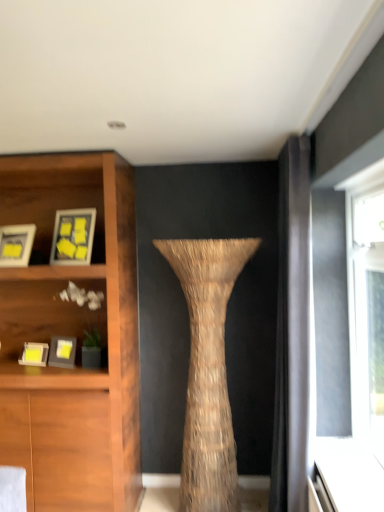
I want to click on matte gray picture frame at left, acting as the fourth picture frame starting from the top, so click(34, 354).

Where is `matte wooden picture frame at upper left, which is counted as the 1th picture frame, starting from the top`? matte wooden picture frame at upper left, which is counted as the 1th picture frame, starting from the top is located at coordinates (73, 236).

This screenshot has height=512, width=384. Describe the element at coordinates (73, 236) in the screenshot. I see `matte wooden picture frame at upper left, the fourth picture frame from the bottom` at that location.

Measure the distance between matte black picture frame at upper left, which is the 3th picture frame from bottom to top, and camera.

matte black picture frame at upper left, which is the 3th picture frame from bottom to top, and camera are 2.80 meters apart.

Identify the location of matte black picture frame at left, the 3th picture frame viewed from the top. The height and width of the screenshot is (512, 384). (62, 352).

Choose the correct answer: Is braided straw vase at center inside matte black picture frame at left, the 2th picture frame from the bottom, or outside it?

braided straw vase at center cannot be found inside matte black picture frame at left, the 2th picture frame from the bottom.

Locate an element on the screen. This screenshot has width=384, height=512. picture frame that is the 2nd one when counting upward from the braided straw vase at center (from the image's perspective) is located at coordinates (62, 352).

Can you confirm if braided straw vase at center is wider than matte black picture frame at left, the 2th picture frame from the bottom?

Correct, the width of braided straw vase at center exceeds that of matte black picture frame at left, the 2th picture frame from the bottom.

Between braided straw vase at center and matte black picture frame at left, the 2th picture frame from the bottom, which one appears on the right side from the viewer's perspective?

braided straw vase at center.

Is matte black picture frame at upper left, which is the 3th picture frame from bottom to top, further to camera compared to matte gray picture frame at left, acting as the fourth picture frame starting from the top?

No, matte black picture frame at upper left, which is the 3th picture frame from bottom to top, is in front of matte gray picture frame at left, acting as the fourth picture frame starting from the top.

Considering the relative sizes of matte black picture frame at upper left, which ranks as the 2th picture frame in top-to-bottom order, and matte gray picture frame at left, which is the first picture frame from bottom to top, in the image provided, is matte black picture frame at upper left, which ranks as the 2th picture frame in top-to-bottom order, shorter than matte gray picture frame at left, which is the first picture frame from bottom to top,?

No.

Does matte black picture frame at upper left, which is the 3th picture frame from bottom to top, have a greater width compared to matte gray picture frame at left, which is the first picture frame from bottom to top?

Yes.

Could you tell me if matte black picture frame at upper left, which ranks as the 2th picture frame in top-to-bottom order, is turned towards matte gray picture frame at left, acting as the fourth picture frame starting from the top?

No, matte black picture frame at upper left, which ranks as the 2th picture frame in top-to-bottom order, is not turned towards matte gray picture frame at left, acting as the fourth picture frame starting from the top.

Is matte gray picture frame at left, acting as the fourth picture frame starting from the top, further to camera compared to matte black picture frame at left, the 3th picture frame viewed from the top?

Yes, the depth of matte gray picture frame at left, acting as the fourth picture frame starting from the top, is greater than that of matte black picture frame at left, the 3th picture frame viewed from the top.

Is matte gray picture frame at left, acting as the fourth picture frame starting from the top, shorter than matte black picture frame at left, the 3th picture frame viewed from the top?

Indeed, matte gray picture frame at left, acting as the fourth picture frame starting from the top, has a lesser height compared to matte black picture frame at left, the 3th picture frame viewed from the top.

Does point (28, 358) come behind point (59, 344)?

No, (28, 358) is in front of (59, 344).

Considering the relative sizes of matte black picture frame at upper left, which is the 3th picture frame from bottom to top, and matte black picture frame at left, the 2th picture frame from the bottom, in the image provided, is matte black picture frame at upper left, which is the 3th picture frame from bottom to top, taller than matte black picture frame at left, the 2th picture frame from the bottom,?

Yes, matte black picture frame at upper left, which is the 3th picture frame from bottom to top, is taller than matte black picture frame at left, the 2th picture frame from the bottom.

Is matte black picture frame at left, the 3th picture frame viewed from the top, inside matte black picture frame at upper left, which is the 3th picture frame from bottom to top?

No, matte black picture frame at upper left, which is the 3th picture frame from bottom to top, does not contain matte black picture frame at left, the 3th picture frame viewed from the top.

Considering the points (19, 239) and (74, 339), which point is behind, point (19, 239) or point (74, 339)?

The point (74, 339) is behind.

Can braided straw vase at center be found inside matte wooden picture frame at upper left, the fourth picture frame from the bottom?

No, braided straw vase at center is located outside of matte wooden picture frame at upper left, the fourth picture frame from the bottom.

Which of these two, matte wooden picture frame at upper left, which is counted as the 1th picture frame, starting from the top, or braided straw vase at center, is bigger?

braided straw vase at center is bigger.

Between point (88, 229) and point (206, 502), which one is positioned behind?

Positioned behind is point (88, 229).

Considering the positions of objects matte wooden picture frame at upper left, the fourth picture frame from the bottom, and braided straw vase at center in the image provided, who is more to the left, matte wooden picture frame at upper left, the fourth picture frame from the bottom, or braided straw vase at center?

matte wooden picture frame at upper left, the fourth picture frame from the bottom.

From the image's perspective, between braided straw vase at center and matte gray picture frame at left, which is the first picture frame from bottom to top, who is located below?

From the image's view, braided straw vase at center is below.

Considering the relative sizes of braided straw vase at center and matte gray picture frame at left, which is the first picture frame from bottom to top, in the image provided, is braided straw vase at center wider than matte gray picture frame at left, which is the first picture frame from bottom to top,?

Yes, braided straw vase at center is wider than matte gray picture frame at left, which is the first picture frame from bottom to top.

Is braided straw vase at center outside of matte gray picture frame at left, acting as the fourth picture frame starting from the top?

Yes.

Which is behind, point (230, 263) or point (26, 343)?

The point (26, 343) is farther from the camera.

Considering their positions, is braided straw vase at center located in front of or behind matte wooden picture frame at upper left, which is counted as the 1th picture frame, starting from the top?

braided straw vase at center is positioned closer to the viewer than matte wooden picture frame at upper left, which is counted as the 1th picture frame, starting from the top.

From the image's perspective, is braided straw vase at center located above or below matte wooden picture frame at upper left, which is counted as the 1th picture frame, starting from the top?

braided straw vase at center is situated lower than matte wooden picture frame at upper left, which is counted as the 1th picture frame, starting from the top, in the image.

Considering the positions of objects braided straw vase at center and matte wooden picture frame at upper left, which is counted as the 1th picture frame, starting from the top, in the image provided, who is more to the right, braided straw vase at center or matte wooden picture frame at upper left, which is counted as the 1th picture frame, starting from the top,?

From the viewer's perspective, braided straw vase at center appears more on the right side.

Is braided straw vase at center completely or partially outside of matte wooden picture frame at upper left, which is counted as the 1th picture frame, starting from the top?

That's correct, braided straw vase at center is outside of matte wooden picture frame at upper left, which is counted as the 1th picture frame, starting from the top.

Find the location of a particular element. Image resolution: width=384 pixels, height=512 pixels. vase below the matte black picture frame at left, the 2th picture frame from the bottom (from the image's perspective) is located at coordinates (208, 369).

At what (x,y) coordinates should I click in order to perform the action: click on picture frame to the left of matte gray picture frame at left, which is the first picture frame from bottom to top. Please return your answer as a coordinate pair (x, y). Looking at the image, I should click on (16, 245).

From the image, which object appears to be farther from matte black picture frame at upper left, which is the 3th picture frame from bottom to top, matte wooden picture frame at upper left, which is counted as the 1th picture frame, starting from the top, or matte gray picture frame at left, acting as the fourth picture frame starting from the top?

matte gray picture frame at left, acting as the fourth picture frame starting from the top, lies further to matte black picture frame at upper left, which is the 3th picture frame from bottom to top, than the other object.

Looking at the image, which one is located further to matte black picture frame at left, the 3th picture frame viewed from the top, matte wooden picture frame at upper left, the fourth picture frame from the bottom, or matte black picture frame at upper left, which is the 3th picture frame from bottom to top?

matte wooden picture frame at upper left, the fourth picture frame from the bottom, is positioned further to the anchor matte black picture frame at left, the 3th picture frame viewed from the top.

Considering their positions, is braided straw vase at center positioned closer to matte wooden picture frame at upper left, which is counted as the 1th picture frame, starting from the top, than matte gray picture frame at left, which is the first picture frame from bottom to top?

matte gray picture frame at left, which is the first picture frame from bottom to top, is positioned closer to the anchor matte wooden picture frame at upper left, which is counted as the 1th picture frame, starting from the top.

Looking at the image, which one is located further to braided straw vase at center, matte black picture frame at upper left, which is the 3th picture frame from bottom to top, or matte black picture frame at left, the 3th picture frame viewed from the top?

matte black picture frame at upper left, which is the 3th picture frame from bottom to top, is further to braided straw vase at center.

Which object lies nearer to the anchor point matte gray picture frame at left, acting as the fourth picture frame starting from the top, matte black picture frame at left, the 2th picture frame from the bottom, or braided straw vase at center?

Among the two, matte black picture frame at left, the 2th picture frame from the bottom, is located nearer to matte gray picture frame at left, acting as the fourth picture frame starting from the top.

Looking at the image, which one is located closer to matte wooden picture frame at upper left, which is counted as the 1th picture frame, starting from the top, matte black picture frame at left, the 3th picture frame viewed from the top, or matte black picture frame at upper left, which ranks as the 2th picture frame in top-to-bottom order?

Based on the image, matte black picture frame at upper left, which ranks as the 2th picture frame in top-to-bottom order, appears to be nearer to matte wooden picture frame at upper left, which is counted as the 1th picture frame, starting from the top.

From the image, which object appears to be farther from braided straw vase at center, matte wooden picture frame at upper left, which is counted as the 1th picture frame, starting from the top, or matte black picture frame at upper left, which is the 3th picture frame from bottom to top?

Based on the image, matte black picture frame at upper left, which is the 3th picture frame from bottom to top, appears to be further to braided straw vase at center.

From the picture: From the image, which object appears to be farther from matte gray picture frame at left, acting as the fourth picture frame starting from the top, matte black picture frame at upper left, which is the 3th picture frame from bottom to top, or matte black picture frame at left, the 2th picture frame from the bottom?

matte black picture frame at upper left, which is the 3th picture frame from bottom to top, lies further to matte gray picture frame at left, acting as the fourth picture frame starting from the top, than the other object.

Where is `picture frame situated between matte black picture frame at left, the 2th picture frame from the bottom, and braided straw vase at center from left to right`? picture frame situated between matte black picture frame at left, the 2th picture frame from the bottom, and braided straw vase at center from left to right is located at coordinates (73, 236).

Find the location of a particular element. Image resolution: width=384 pixels, height=512 pixels. picture frame that lies between matte black picture frame at upper left, which is the 3th picture frame from bottom to top, and matte gray picture frame at left, which is the first picture frame from bottom to top, from top to bottom is located at coordinates (62, 352).

Where is `picture frame that lies between matte wooden picture frame at upper left, the fourth picture frame from the bottom, and matte black picture frame at left, the 3th picture frame viewed from the top, from top to bottom`? This screenshot has width=384, height=512. picture frame that lies between matte wooden picture frame at upper left, the fourth picture frame from the bottom, and matte black picture frame at left, the 3th picture frame viewed from the top, from top to bottom is located at coordinates (16, 245).